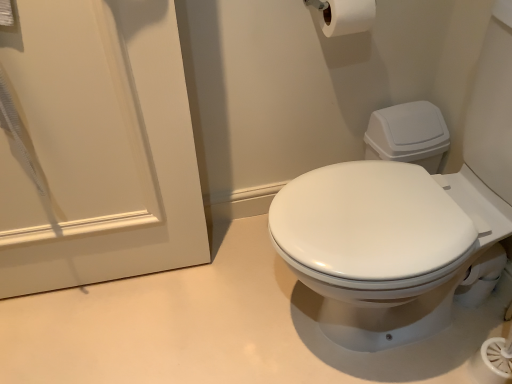
The image size is (512, 384). Find the location of `vacant point to the right of white matte door at upper left`. vacant point to the right of white matte door at upper left is located at coordinates (216, 300).